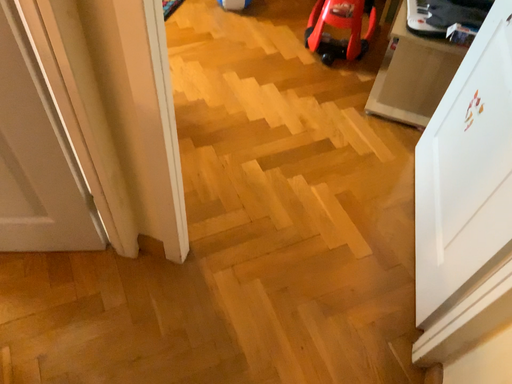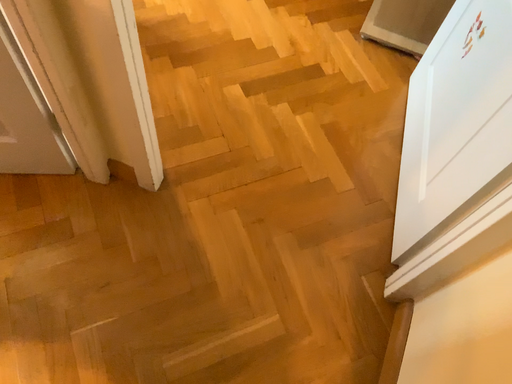
Question: Which way did the camera rotate in the video?

Choices:
 (A) rotated upward
 (B) rotated downward

Answer: (B)